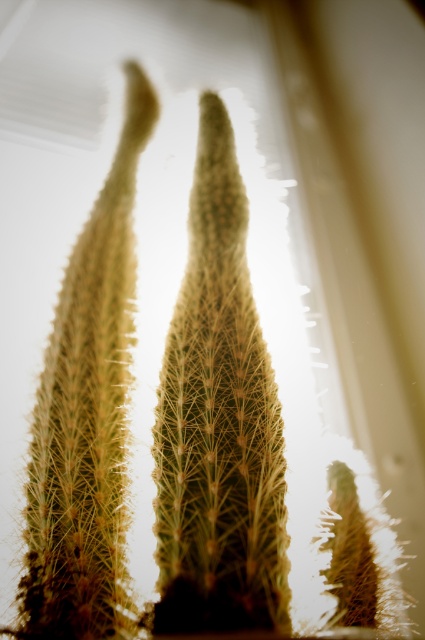
You are standing in front of the cacti and want to reach the point at coordinates point (260,376). If your arm can extend 36 inches, can you safely reach that point without moving closer?

The point (260,376) is 35.55 inches from the viewer. Since your arm can extend 36 inches, you can safely reach it without moving closer.

You are standing in front of the cacti and want to move from the green spiky cactus at left to the green spiky cactus at center. Which direction should you move?

The green spiky cactus at center is to the right of the green spiky cactus at left, so you should move to the right to reach it.